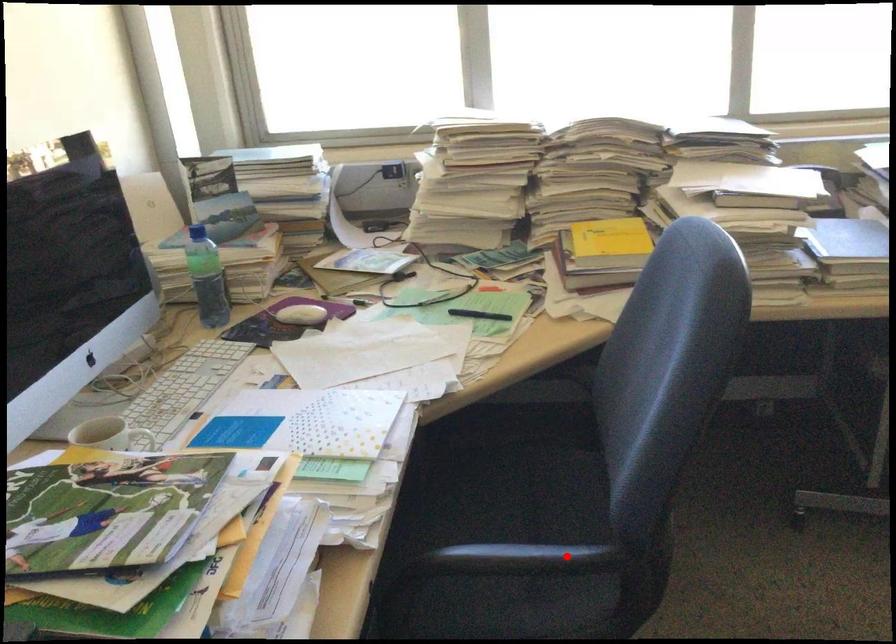
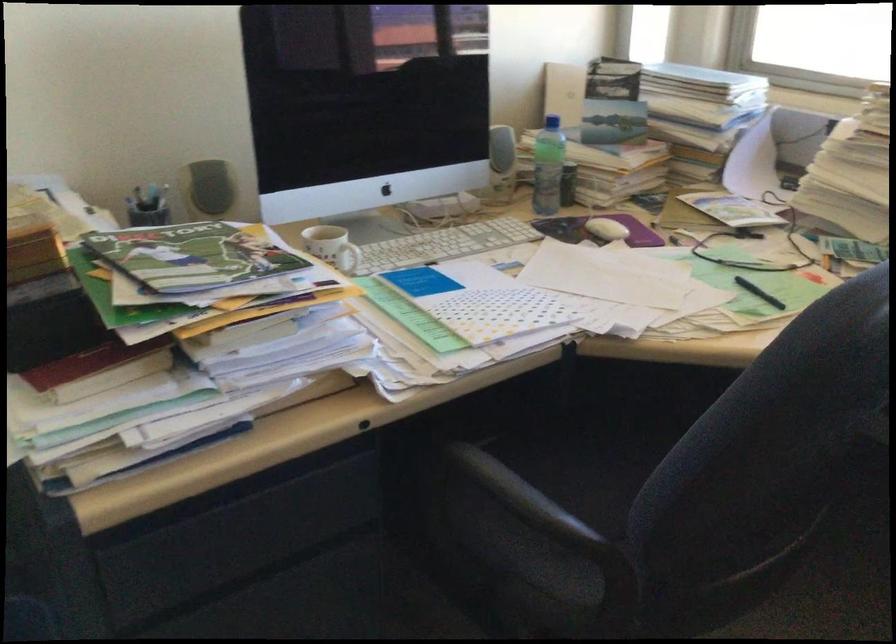
In the second image, find the point that corresponds to the highlighted location in the first image.

(532, 506)